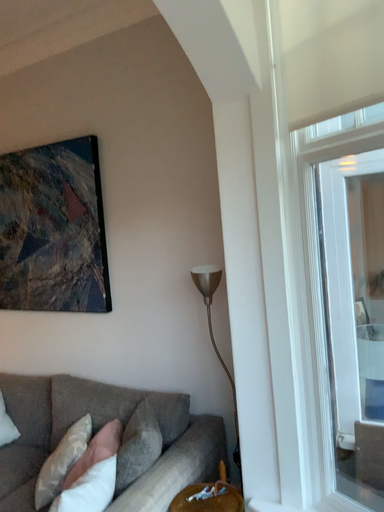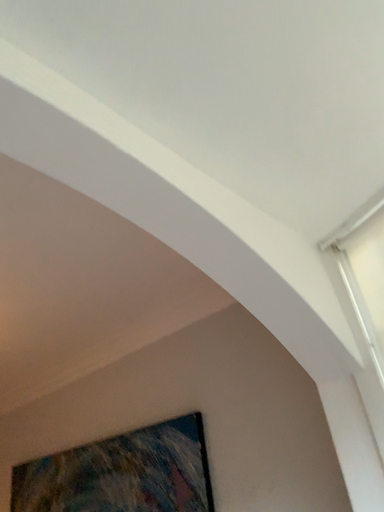
Question: How did the camera likely rotate when shooting the video?

Choices:
 (A) rotated downward
 (B) rotated upward

Answer: (B)